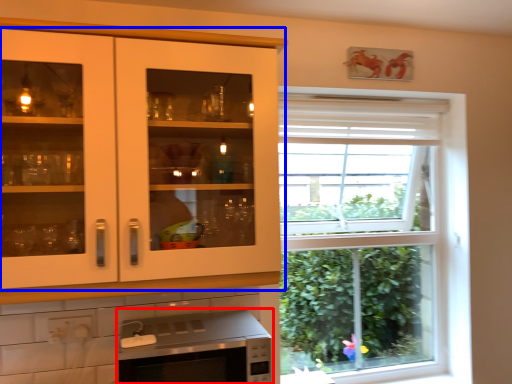
Question: Which point is further to the camera, microwave oven (highlighted by a red box) or cabinetry (highlighted by a blue box)?

Choices:
 (A) microwave oven
 (B) cabinetry

Answer: (A)